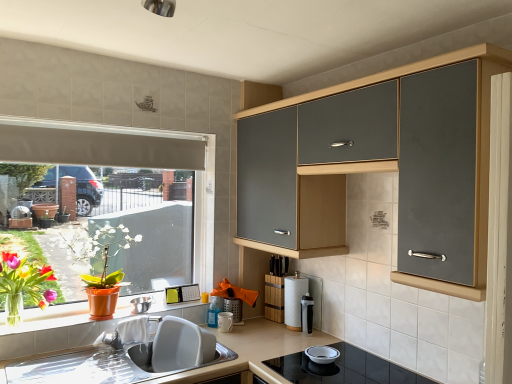
Question: From a real-world perspective, is black plastic water bottle at upper right, the first appliance viewed from the right, positioned over translucent plastic bottle at upper center, which appears as the 2th appliance when viewed from the left, based on gravity?

Choices:
 (A) yes
 (B) no

Answer: (A)

Question: From the image's perspective, is black plastic water bottle at upper right, which is the 6th appliance in left-to-right order, over translucent plastic bottle at upper center, positioned as the 5th appliance in right-to-left order?

Choices:
 (A) yes
 (B) no

Answer: (A)

Question: Is black plastic water bottle at upper right, which is the 6th appliance in left-to-right order, to the right of translucent plastic bottle at upper center, positioned as the 5th appliance in right-to-left order, from the viewer's perspective?

Choices:
 (A) yes
 (B) no

Answer: (A)

Question: Is black plastic water bottle at upper right, which is the 6th appliance in left-to-right order, facing away from translucent plastic bottle at upper center, which appears as the 2th appliance when viewed from the left?

Choices:
 (A) yes
 (B) no

Answer: (B)

Question: Is black plastic water bottle at upper right, which is the 6th appliance in left-to-right order, directly adjacent to translucent plastic bottle at upper center, positioned as the 5th appliance in right-to-left order?

Choices:
 (A) yes
 (B) no

Answer: (B)

Question: Does black plastic water bottle at upper right, the first appliance viewed from the right, appear on the left side of translucent plastic bottle at upper center, which appears as the 2th appliance when viewed from the left?

Choices:
 (A) no
 (B) yes

Answer: (A)

Question: From a real-world perspective, does matte gray cabinet at upper right sit lower than metallic stainless steel bowl at upper left, which is the sixth appliance from right to left?

Choices:
 (A) no
 (B) yes

Answer: (A)

Question: Is matte gray cabinet at upper right facing away from metallic stainless steel bowl at upper left, the first appliance positioned from the left?

Choices:
 (A) no
 (B) yes

Answer: (A)

Question: Is matte gray cabinet at upper right in front of metallic stainless steel bowl at upper left, the first appliance positioned from the left?

Choices:
 (A) yes
 (B) no

Answer: (A)

Question: Can you confirm if matte gray cabinet at upper right is thinner than metallic stainless steel bowl at upper left, the first appliance positioned from the left?

Choices:
 (A) no
 (B) yes

Answer: (A)

Question: Can you confirm if matte gray cabinet at upper right is shorter than metallic stainless steel bowl at upper left, which is the sixth appliance from right to left?

Choices:
 (A) yes
 (B) no

Answer: (B)

Question: Is matte gray cabinet at upper right at the right side of metallic stainless steel bowl at upper left, which is the sixth appliance from right to left?

Choices:
 (A) no
 (B) yes

Answer: (B)

Question: Is matte orange pot at left facing away from metallic stainless steel bowl at upper left, which is the sixth appliance from right to left?

Choices:
 (A) yes
 (B) no

Answer: (B)